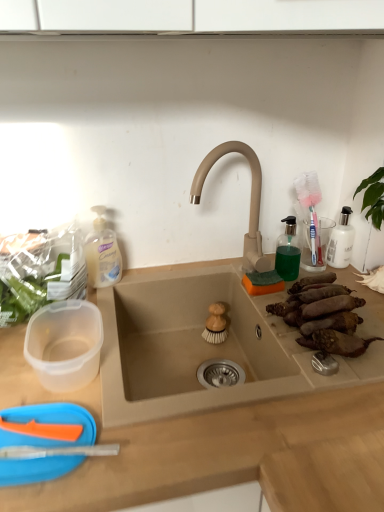
Where is `vacant space in front of transparent plastic soap dispenser at upper right`? This screenshot has width=384, height=512. vacant space in front of transparent plastic soap dispenser at upper right is located at coordinates (294, 321).